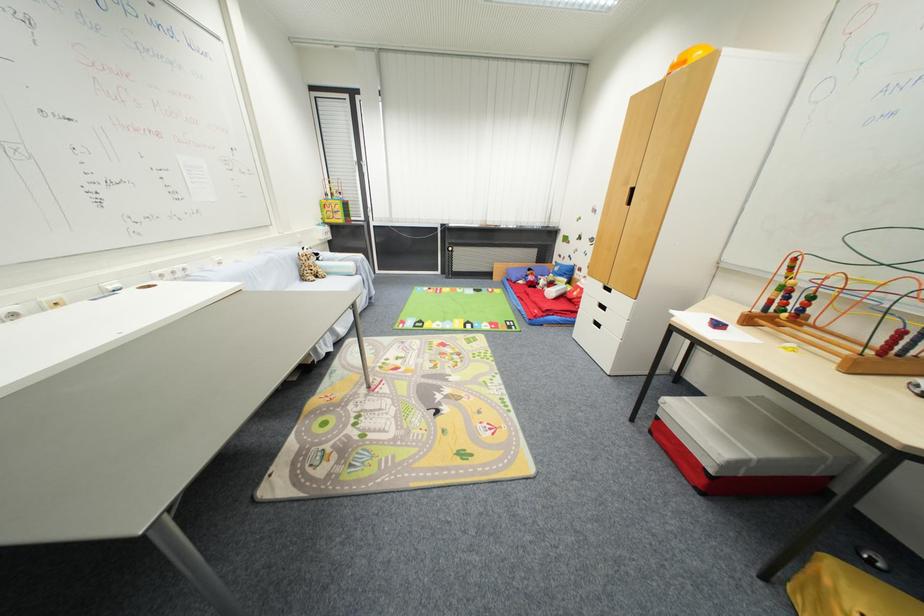
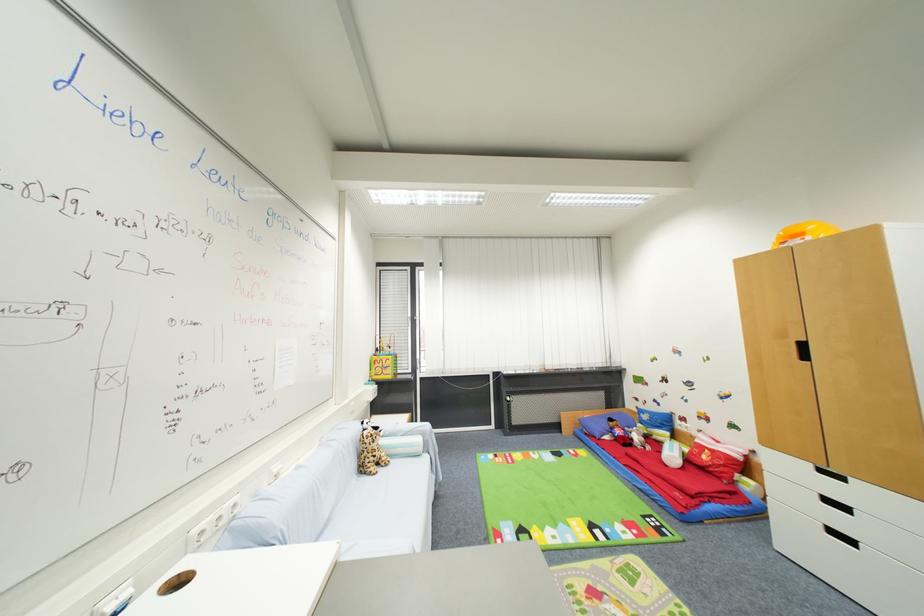
Which direction would the cameraman need to move to produce the second image?

The movement direction of the cameraman is left, forward.